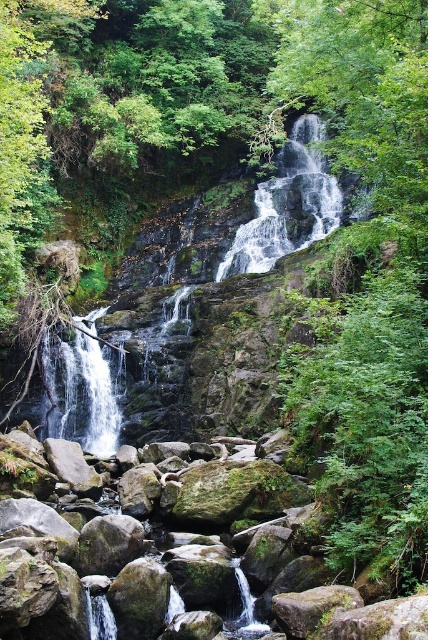
Can you confirm if clear water stream at center is positioned below white frothy water at left?

Actually, clear water stream at center is above white frothy water at left.

Does point (101, 419) come in front of point (85, 442)?

No.

Identify the location of clear water stream at center. The height and width of the screenshot is (640, 428). (285, 205).

Does point (336, 218) lie behind point (262, 209)?

That is False.

Based on the photo, which of these two, clear water stream at center or white frothy water at center, stands taller?

With more height is clear water stream at center.

Where is `clear water stream at center`? clear water stream at center is located at coordinates (285, 205).

Identify the location of clear water stream at center. (285, 205).

Who is positioned more to the left, white frothy water at center or white frothy water at left?

white frothy water at left is more to the left.

Does point (293, 173) come in front of point (107, 404)?

No, (293, 173) is further to viewer.

The height and width of the screenshot is (640, 428). I want to click on white frothy water at center, so click(x=287, y=205).